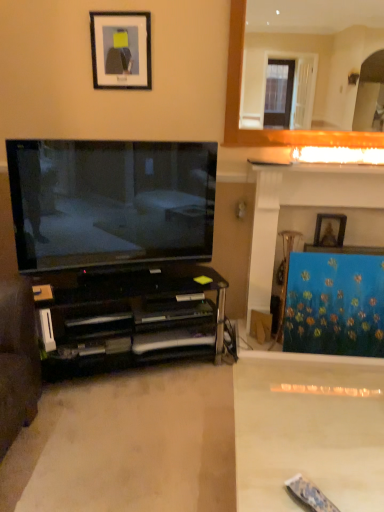
This screenshot has height=512, width=384. In order to click on unoccupied area in front of black glass cabinet at left in this screenshot , I will do `click(113, 433)`.